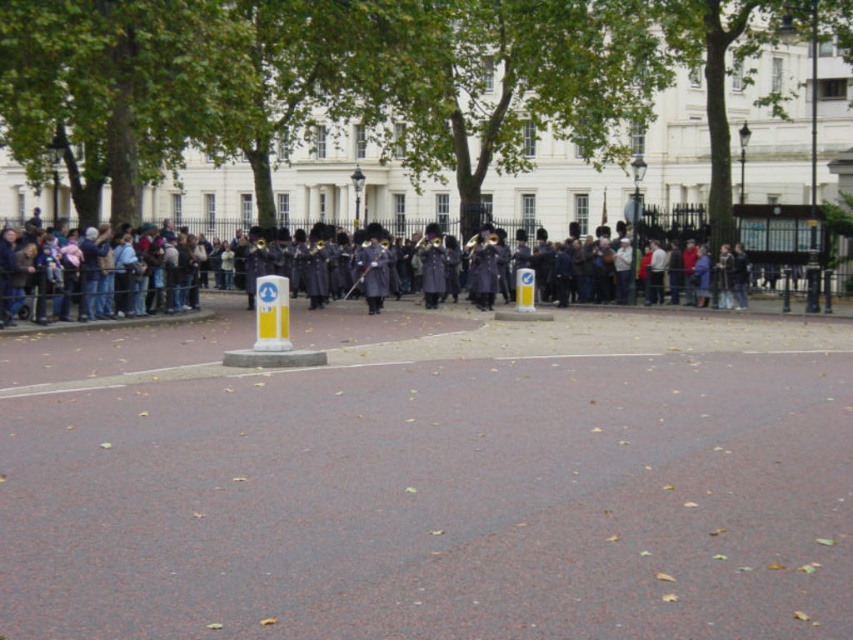
You are a photographer trying to capture the entire white glossy building at center and dark gray uniform at center in a single frame. Based on their sizes, which one should you focus on to ensure both are visible without cropping?

The white glossy building at center is larger in size than the dark gray uniform at center, so you should focus on the white glossy building at center to ensure both are visible without cropping.

You are a photographer at the event and want to capture the entire white glossy building at center and dark gray uniform at center in a single frame. Based on their widths, which object should you position closer to the edge of the frame to ensure both fit?

Since the white glossy building at center is wider than the dark gray uniform at center, you should position the wider white glossy building at center closer to the edge of the frame to ensure both fit within the single frame.

You are standing at the event and want to take a photo of the white glossy building at center. Your camera has a maximum focus range of 20 meters. Can you capture the building clearly?

The white glossy building at center is 22.54 meters away from the viewer. Since your camera can only focus up to 20 meters, it won not be able to capture the building clearly.